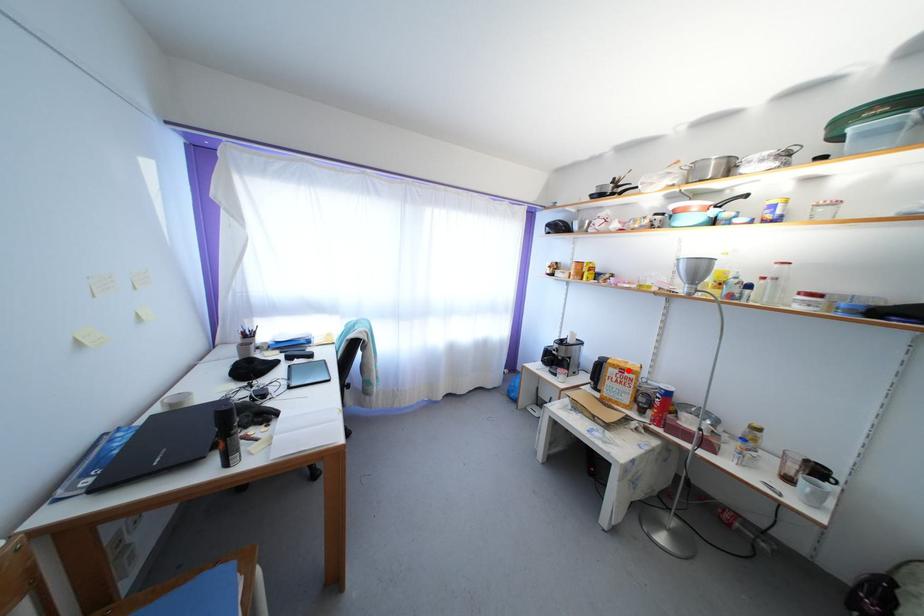
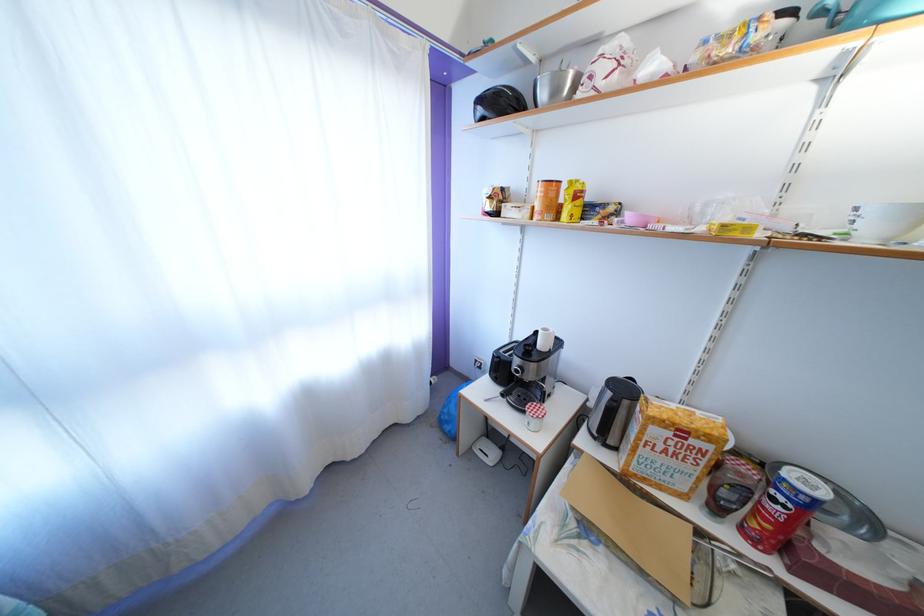
The point at the highlighted location is marked in the first image. Where is the corresponding point in the second image?

(688, 428)